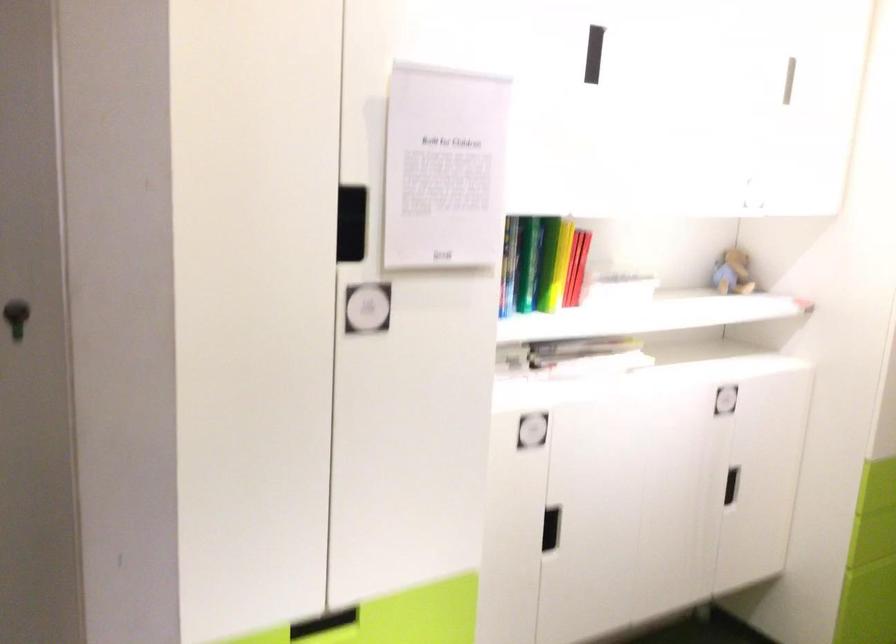
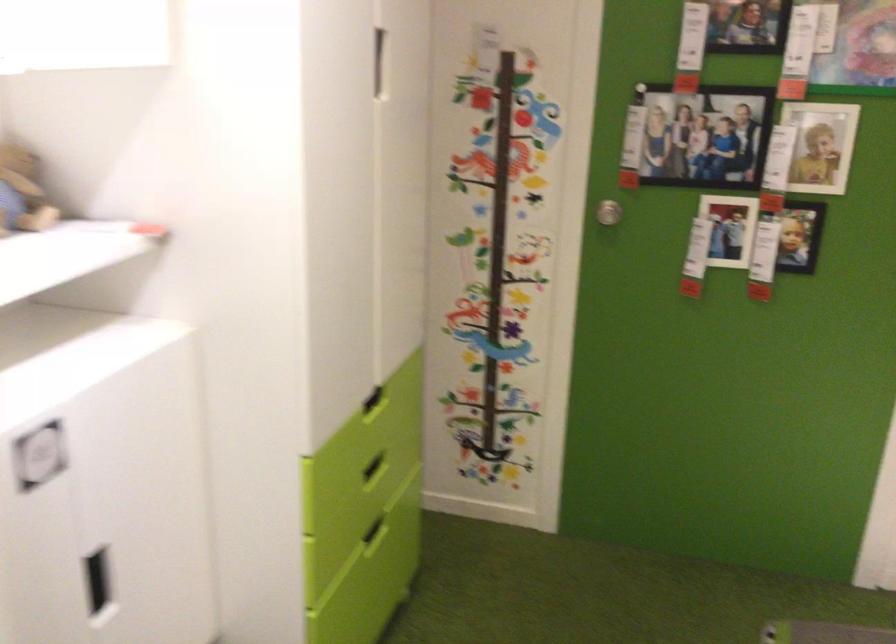
Find the pixel in the second image that matches (729,272) in the first image.

(22, 192)